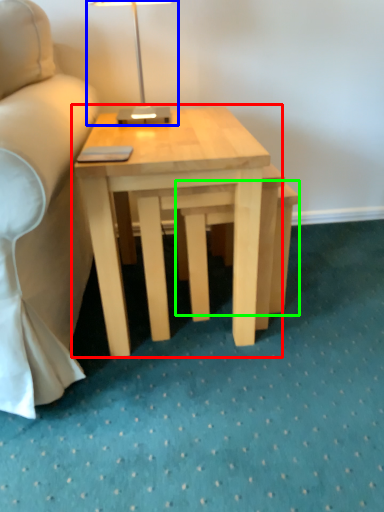
Question: Estimate the real-world distances between objects in this image. Which object is farther from coffee table (highlighted by a red box), table lamp (highlighted by a blue box) or step stool (highlighted by a green box)?

Choices:
 (A) table lamp
 (B) step stool

Answer: (A)